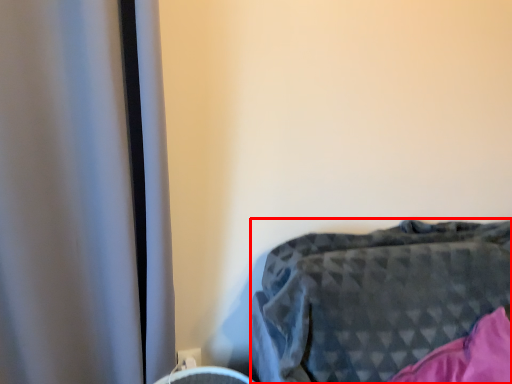
Question: Where is furniture (annotated by the red box) located in relation to electric outlet in the image?

Choices:
 (A) right
 (B) left

Answer: (A)